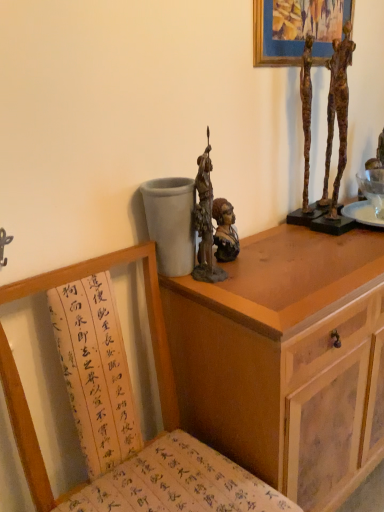
Question: Does rusty bronze statue at center appear on the right side of bronze bust at center, placed as the 2th person when sorted from right to left?

Choices:
 (A) yes
 (B) no

Answer: (B)

Question: Does rusty bronze statue at center come behind bronze bust at center, placed as the 2th person when sorted from right to left?

Choices:
 (A) no
 (B) yes

Answer: (A)

Question: Is rusty bronze statue at center not close to bronze bust at center, placed as the 2th person when sorted from right to left?

Choices:
 (A) no
 (B) yes

Answer: (A)

Question: From a real-world perspective, is rusty bronze statue at center positioned under bronze bust at center, the first person positioned from the left, based on gravity?

Choices:
 (A) no
 (B) yes

Answer: (A)

Question: Is rusty bronze statue at center at the left side of bronze bust at center, the first person positioned from the left?

Choices:
 (A) no
 (B) yes

Answer: (B)

Question: Is rusty metal sculpture at upper right, which ranks as the 1th person in right-to-left order, taller or shorter than wooden cabinet at upper right?

Choices:
 (A) short
 (B) tall

Answer: (A)

Question: Considering the relative positions of rusty metal sculpture at upper right, which is counted as the 2th person, starting from the left, and wooden cabinet at upper right in the image provided, is rusty metal sculpture at upper right, which is counted as the 2th person, starting from the left, to the left or to the right of wooden cabinet at upper right?

Choices:
 (A) left
 (B) right

Answer: (A)

Question: Is rusty metal sculpture at upper right, which ranks as the 1th person in right-to-left order, situated inside wooden cabinet at upper right or outside?

Choices:
 (A) outside
 (B) inside

Answer: (A)

Question: In terms of size, does rusty metal sculpture at upper right, which is counted as the 2th person, starting from the left, appear bigger or smaller than wooden cabinet at upper right?

Choices:
 (A) small
 (B) big

Answer: (A)

Question: In the image, is wooden chair with calligraphy cushion at lower left on the left side or the right side of wooden cabinet at upper right?

Choices:
 (A) left
 (B) right

Answer: (A)

Question: Is wooden chair with calligraphy cushion at lower left wider or thinner than wooden cabinet at upper right?

Choices:
 (A) thin
 (B) wide

Answer: (B)

Question: Looking at the image, does wooden chair with calligraphy cushion at lower left seem bigger or smaller compared to wooden cabinet at upper right?

Choices:
 (A) big
 (B) small

Answer: (B)

Question: From the image's perspective, is wooden chair with calligraphy cushion at lower left located above or below wooden cabinet at upper right?

Choices:
 (A) below
 (B) above

Answer: (A)

Question: Would you say rusty bronze statue at center is inside or outside bronze bust at center, the first person positioned from the left?

Choices:
 (A) inside
 (B) outside

Answer: (B)

Question: In terms of height, does rusty bronze statue at center look taller or shorter compared to bronze bust at center, placed as the 2th person when sorted from right to left?

Choices:
 (A) tall
 (B) short

Answer: (A)